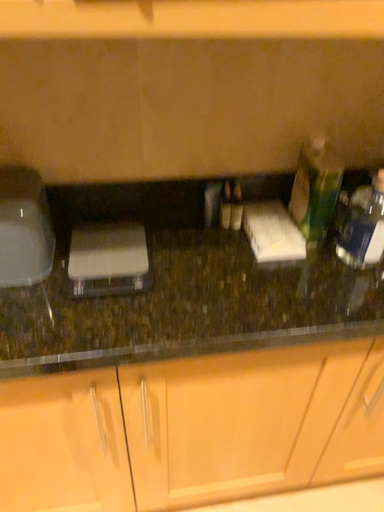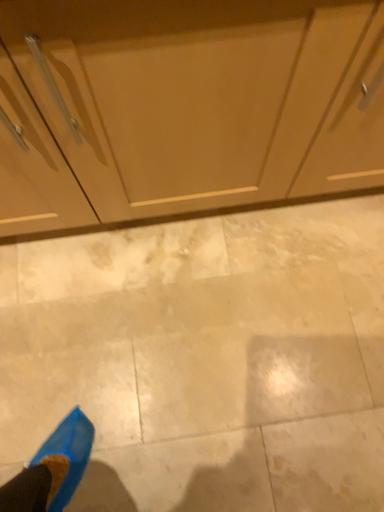
Question: Which way did the camera rotate in the video?

Choices:
 (A) rotated downward
 (B) rotated upward

Answer: (A)